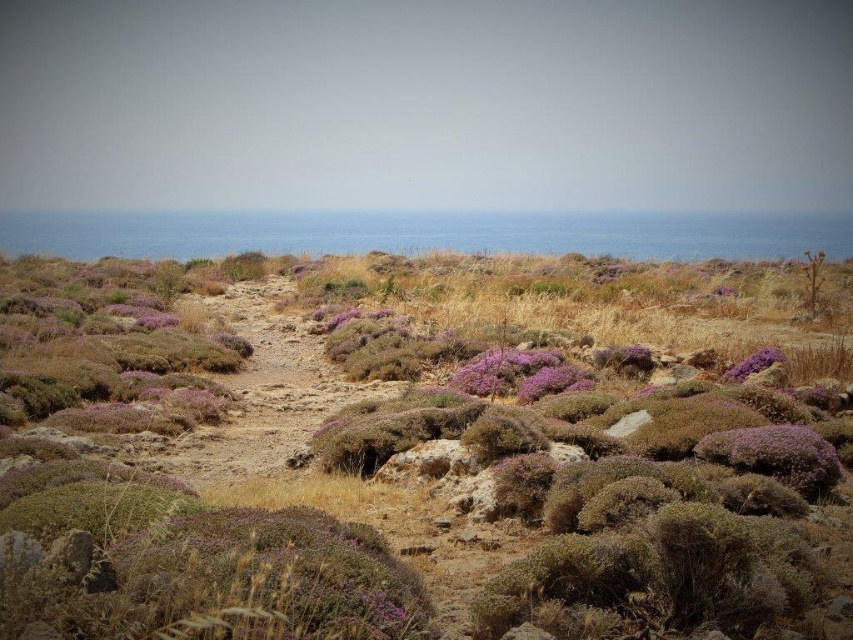
Question: Among these objects, which one is nearest to the camera?

Choices:
 (A) purple fuzzy bush at center-right
 (B) purple fuzzy bush at center

Answer: (B)

Question: Considering the relative positions of purple shrubbery at center and purple fuzzy bush at center-right in the image provided, where is purple shrubbery at center located with respect to purple fuzzy bush at center-right?

Choices:
 (A) above
 (B) below

Answer: (A)

Question: Is purple shrubbery at center below purple fuzzy bush at center-right?

Choices:
 (A) yes
 (B) no

Answer: (B)

Question: Based on their relative distances, which object is farther from the purple shrubbery at center?

Choices:
 (A) purple fuzzy bush at center
 (B) purple fuzzy bush at center-right

Answer: (B)

Question: Estimate the real-world distances between objects in this image. Which object is closer to the purple shrubbery at center?

Choices:
 (A) purple fuzzy bush at center-right
 (B) purple fuzzy bush at center

Answer: (B)

Question: Is the position of purple shrubbery at center more distant than that of purple fuzzy bush at center?

Choices:
 (A) no
 (B) yes

Answer: (A)